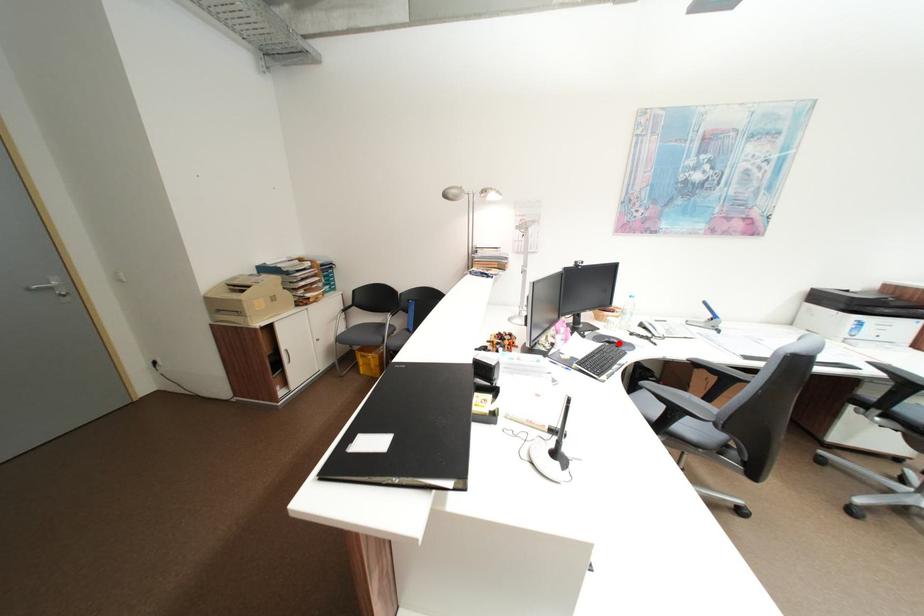
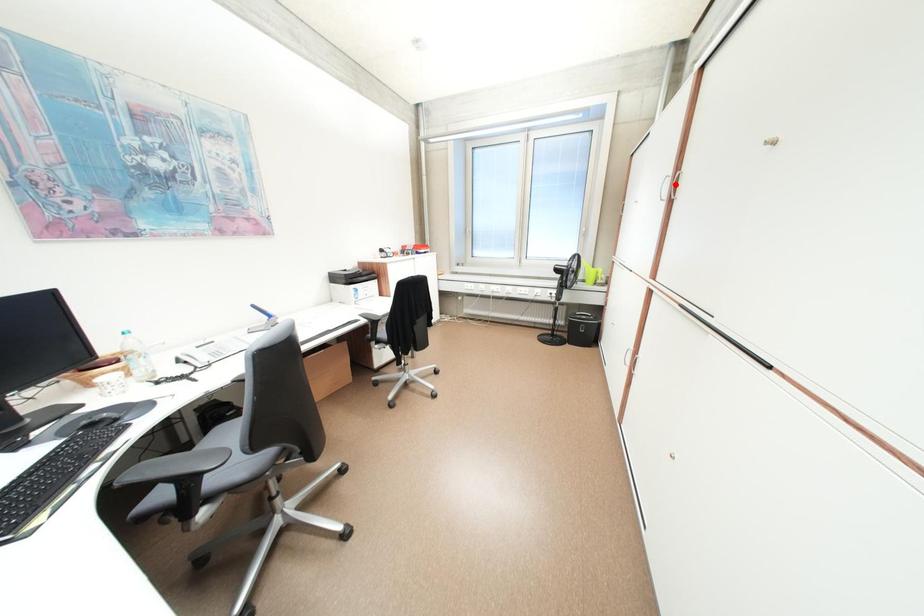
I am providing you with two images of the same scene from different viewpoints. A red point is marked on the first image and another point is marked on the second image. Does the point marked in image1 correspond to the same location as the one in image2?

No